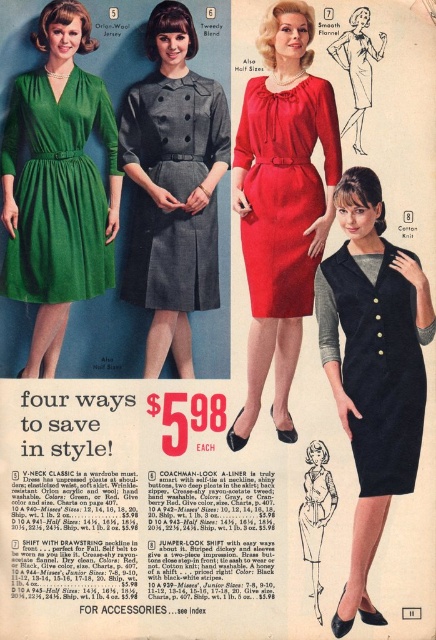
Question: Can you confirm if smooth flannel dress at center is smaller than black wool dress at center?

Choices:
 (A) yes
 (B) no

Answer: (B)

Question: Among these objects, which one is nearest to the camera?

Choices:
 (A) smooth flannel dress at center
 (B) velvet navy dress at center

Answer: (A)

Question: Which of the following is the closest to the observer?

Choices:
 (A) (17, 198)
 (B) (186, 93)
 (C) (320, 477)

Answer: (A)

Question: Which point is closer to the camera taking this photo?

Choices:
 (A) (166, 323)
 (B) (354, 260)
 (C) (252, 154)

Answer: (B)

Question: Observing the image, what is the correct spatial positioning of twilly blend wool dress at center in reference to black wool dress at center?

Choices:
 (A) below
 (B) above

Answer: (B)

Question: Is twilly blend wool dress at center smaller than green wool jersey dress at left?

Choices:
 (A) no
 (B) yes

Answer: (A)